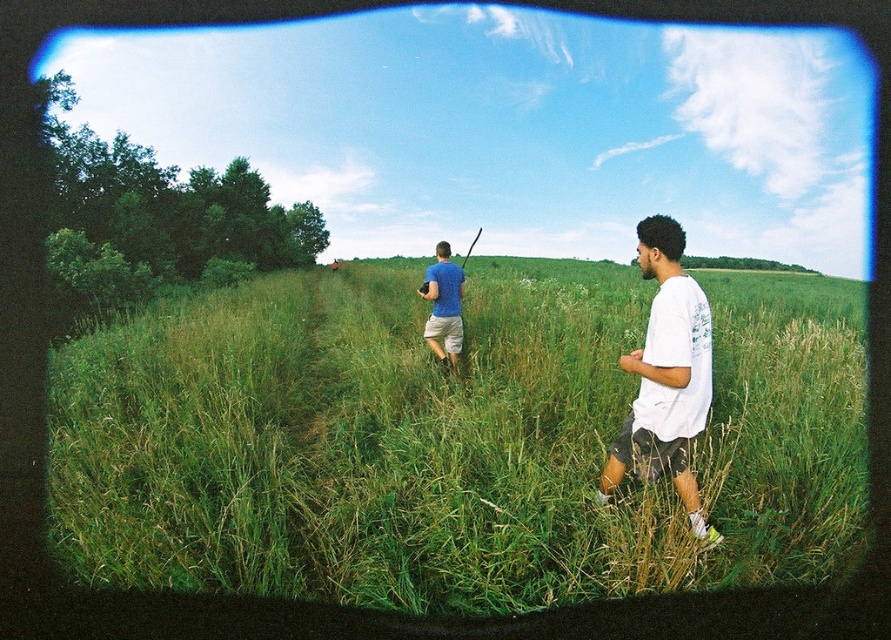
Question: Which point appears closest to the camera in this image?

Choices:
 (A) (786, 397)
 (B) (664, 339)

Answer: (B)

Question: Is the position of green grass at center less distant than that of white cotton t-shirt at right?

Choices:
 (A) yes
 (B) no

Answer: (A)

Question: Is white cotton t-shirt at right to the right of matte blue t-shirt at center from the viewer's perspective?

Choices:
 (A) yes
 (B) no

Answer: (A)

Question: Which object is closer to the camera taking this photo?

Choices:
 (A) matte blue t-shirt at center
 (B) green grass at center
 (C) white cotton t-shirt at right

Answer: (B)

Question: Which object is closer to the camera taking this photo?

Choices:
 (A) matte blue t-shirt at center
 (B) white cotton t-shirt at right

Answer: (B)

Question: Does green grass at center have a smaller size compared to matte blue t-shirt at center?

Choices:
 (A) yes
 (B) no

Answer: (B)